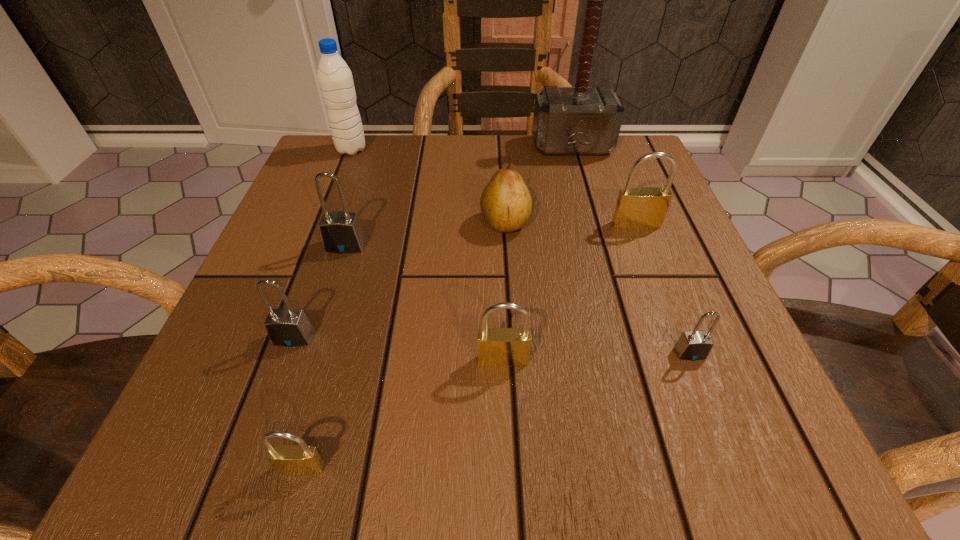
Identify the location of the third padlock from right to left. (497, 347).

You are a GUI agent. You are given a task and a screenshot of the screen. Output one action in this format:
    pyautogui.click(x=<x>, y=<y>)
    Task: Click on the second brass padlock from left to right
    
    Given the screenshot: What is the action you would take?
    pyautogui.click(x=497, y=347)

This screenshot has width=960, height=540. In order to click on the smallest gray padlock in this screenshot , I will do 695,345.

Where is `the smallest brass padlock`? The height and width of the screenshot is (540, 960). the smallest brass padlock is located at coordinates (302, 459).

Find the location of `the leftmost brass padlock`. the leftmost brass padlock is located at coordinates tap(302, 459).

Locate an element on the screen. free location located 0.300m on the front of the brown hammer is located at coordinates (601, 252).

Where is `vacant space located on the right of the gray water bottle`? This screenshot has height=540, width=960. vacant space located on the right of the gray water bottle is located at coordinates click(x=491, y=150).

I want to click on vacant space located on the shackle of the biggest gray padlock, so click(336, 275).

The height and width of the screenshot is (540, 960). In order to click on vacant space located 0.390m on the front-facing side of the biggest brass padlock in this screenshot , I will do `click(718, 436)`.

You are a GUI agent. You are given a task and a screenshot of the screen. Output one action in this format:
    pyautogui.click(x=<x>, y=<y>)
    Task: Click on the free space located on the back of the pear
    This screenshot has height=540, width=960.
    Given the screenshot: What is the action you would take?
    pyautogui.click(x=501, y=167)